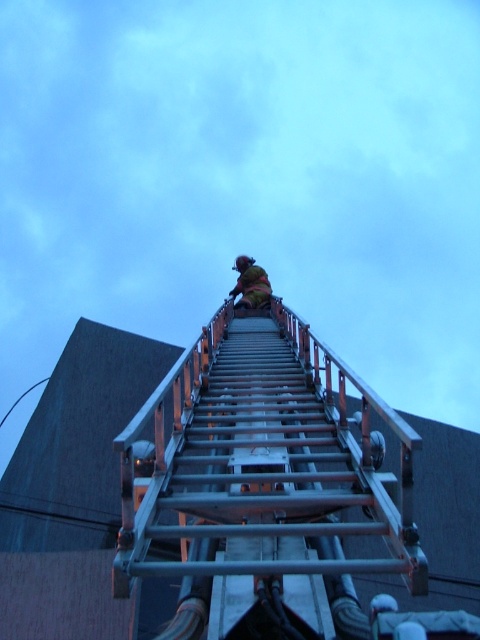
You are a photographer trying to capture the firefighter on the ladder. You notice the metallic silver ladder at upper center and the yellow fabric at upper center in your frame. Which object is wider in the image?

The metallic silver ladder at upper center is wider than the yellow fabric at upper center according to the description.

From the picture: You are a firefighter looking up at the scene. The metallic silver ladder at upper center and the yellow fabric at upper center are both in your view. Which object is closer to you?

The metallic silver ladder at upper center is positioned under the yellow fabric at upper center, so the yellow fabric at upper center is closer to you.

You are a drone operator trying to capture a photo of the firefighter on the ladder. You need to focus on the point that is closer to the camera. Which point should you choose between point (379, 397) and point (242, 264)?

Point (379, 397) is closer to the camera than point (242, 264), so you should focus on point (379, 397).